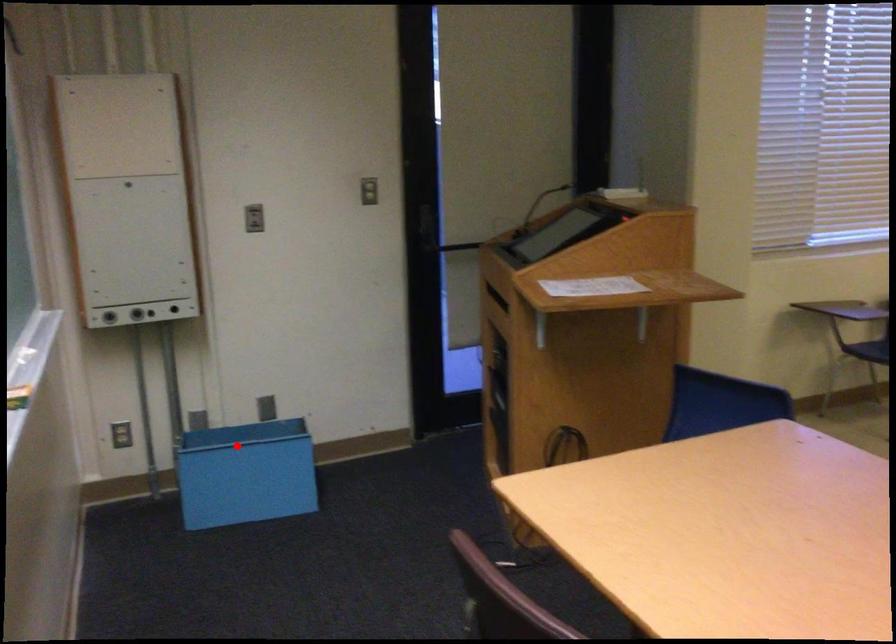
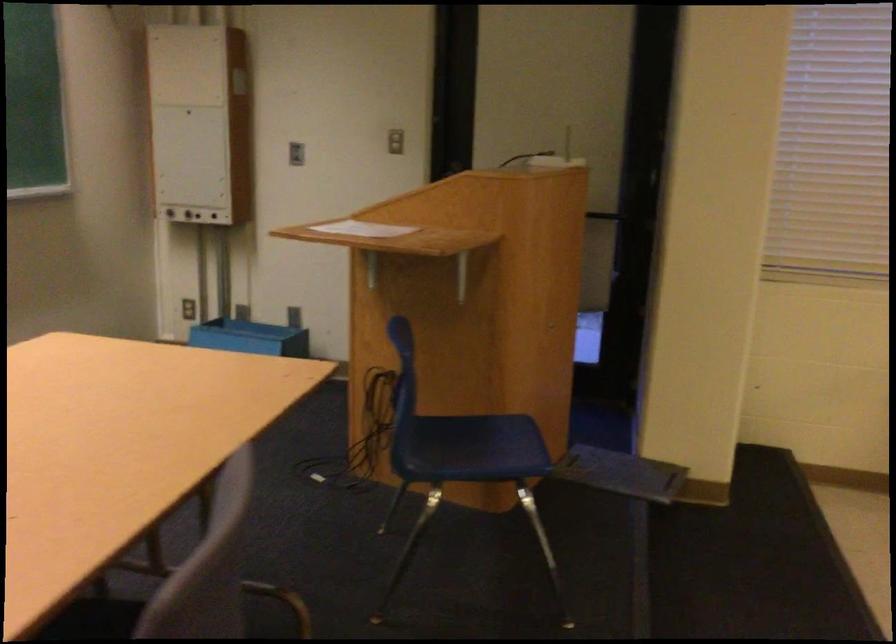
Question: I am providing you with two images of the same scene from different viewpoints. In image1, a red point is highlighted. Considering the same 3D point in image2, which of the following is correct?

Choices:
 (A) It is closer
 (B) It is farther

Answer: (B)